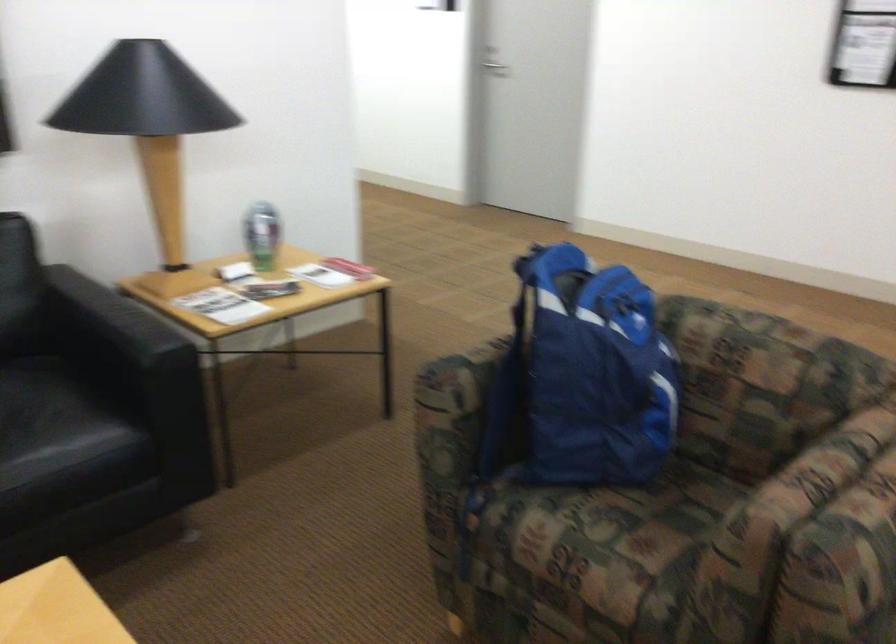
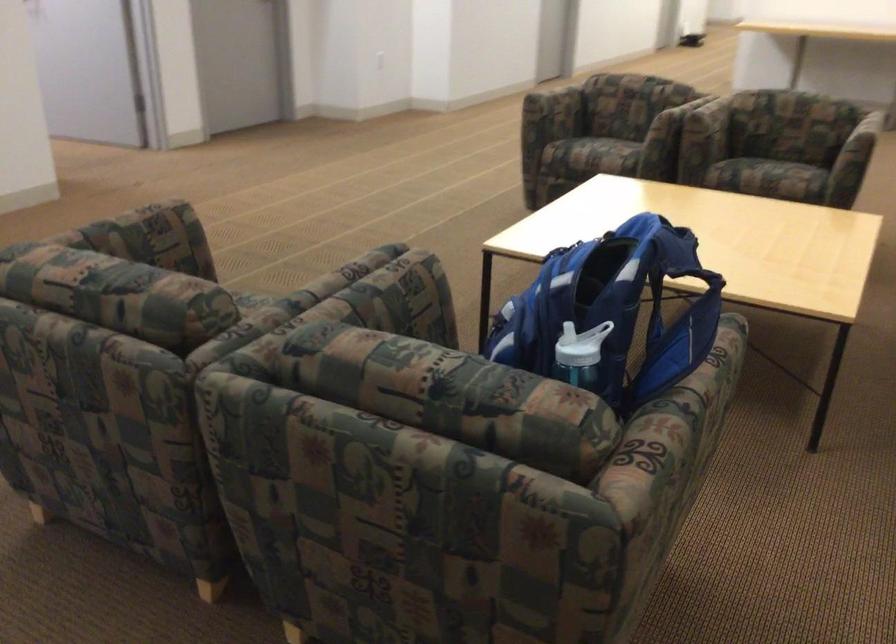
Find the pixel in the second image that matches (x=823, y=447) in the first image.

(362, 292)